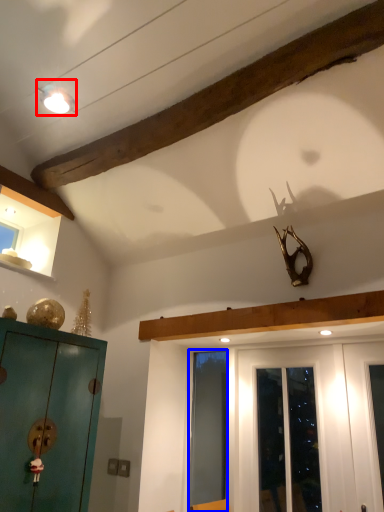
Question: Which object appears farthest to the camera in this image, light fixture (highlighted by a red box) or screen door (highlighted by a blue box)?

Choices:
 (A) light fixture
 (B) screen door

Answer: (B)